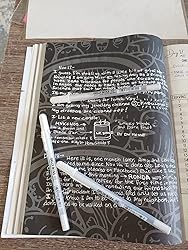
At what (x,y) coordinates should I click in order to perform the action: click on brown table. Please return your answer as a coordinate pair (x, y). This screenshot has width=188, height=250. Looking at the image, I should click on (9, 106).